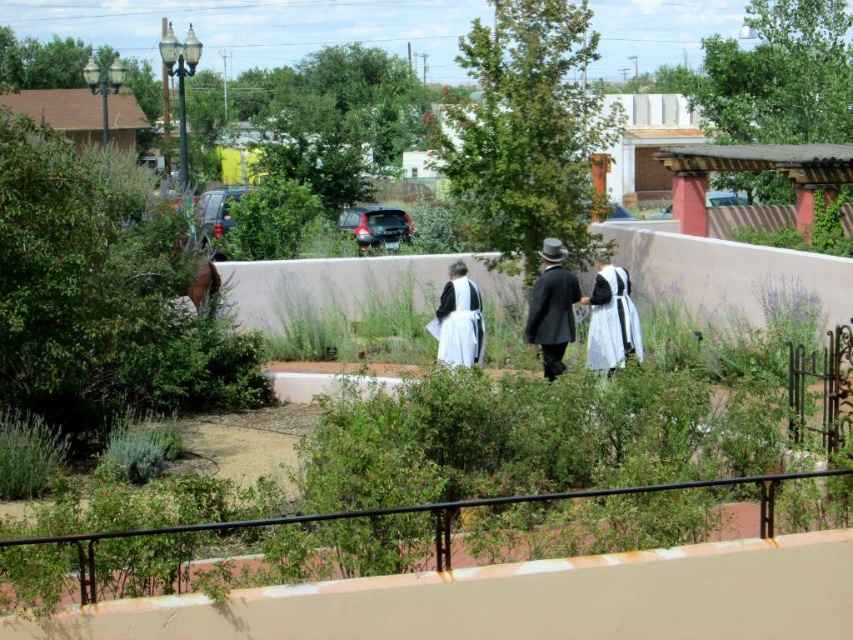
Locate an element on the screen. Image resolution: width=853 pixels, height=640 pixels. white matte dress at center is located at coordinates (611, 321).

Is white matte dress at center thinner than white satin dress at center?

No.

Which is behind, point (618, 289) or point (463, 298)?

Point (618, 289)

At what (x,y) coordinates should I click in order to perform the action: click on white matte dress at center. Please return your answer as a coordinate pair (x, y). This screenshot has height=640, width=853. Looking at the image, I should click on (611, 321).

Where is `matte black coat at center`? matte black coat at center is located at coordinates (552, 308).

Can you confirm if matte black coat at center is wider than white satin dress at center?

In fact, matte black coat at center might be narrower than white satin dress at center.

Which is behind, point (549, 346) or point (450, 346)?

Positioned behind is point (450, 346).

Locate an element on the screen. The width and height of the screenshot is (853, 640). matte black coat at center is located at coordinates click(x=552, y=308).

Does matte black coat at center have a greater height compared to white matte dress at center?

Yes.

In the scene shown: Is matte black coat at center in front of white matte dress at center?

Yes.

Does point (531, 333) lie behind point (590, 296)?

No.

Where is `matte black coat at center`? matte black coat at center is located at coordinates (552, 308).